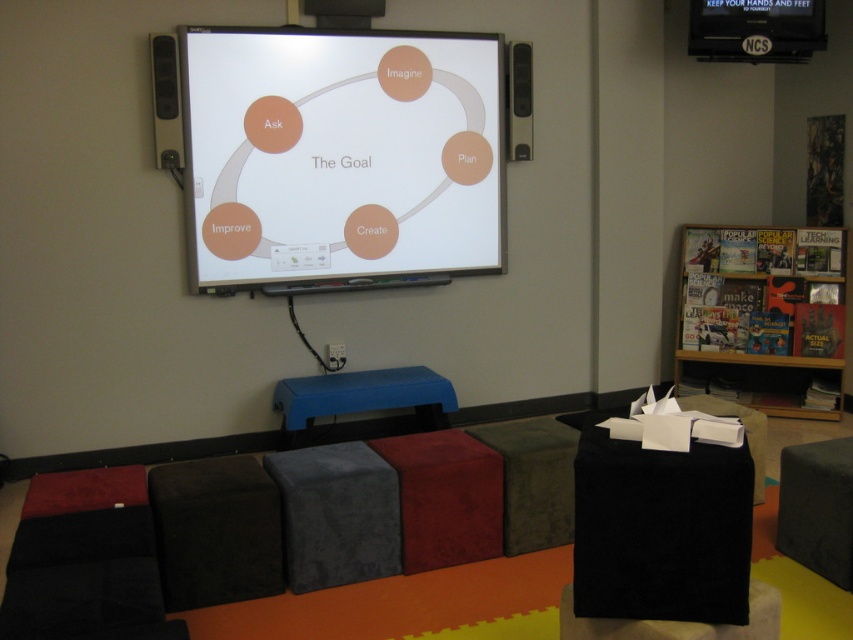
Question: Which point is closer to the camera?

Choices:
 (A) (213, 161)
 (B) (814, 48)

Answer: (A)

Question: Which object appears farthest from the camera in this image?

Choices:
 (A) white glossy projection screen at upper center
 (B) black fabric hassock at upper right

Answer: (B)

Question: Considering the relative positions of white glossy projection screen at upper center and black fabric hassock at upper right in the image provided, where is white glossy projection screen at upper center located with respect to black fabric hassock at upper right?

Choices:
 (A) right
 (B) left

Answer: (B)

Question: Can you confirm if white glossy projection screen at upper center is positioned to the right of blue rubber stool at center?

Choices:
 (A) no
 (B) yes

Answer: (A)

Question: Which object is farther from the camera taking this photo?

Choices:
 (A) black fabric hassock at upper right
 (B) white glossy projection screen at upper center
 (C) blue rubber stool at center

Answer: (A)

Question: Can you confirm if black fabric hassock at upper right is positioned below blue rubber stool at center?

Choices:
 (A) no
 (B) yes

Answer: (A)